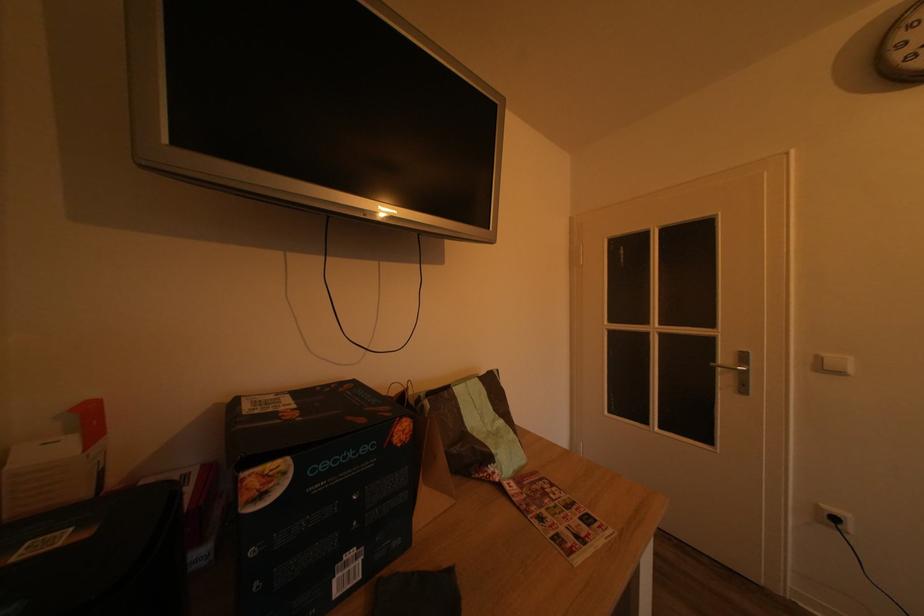
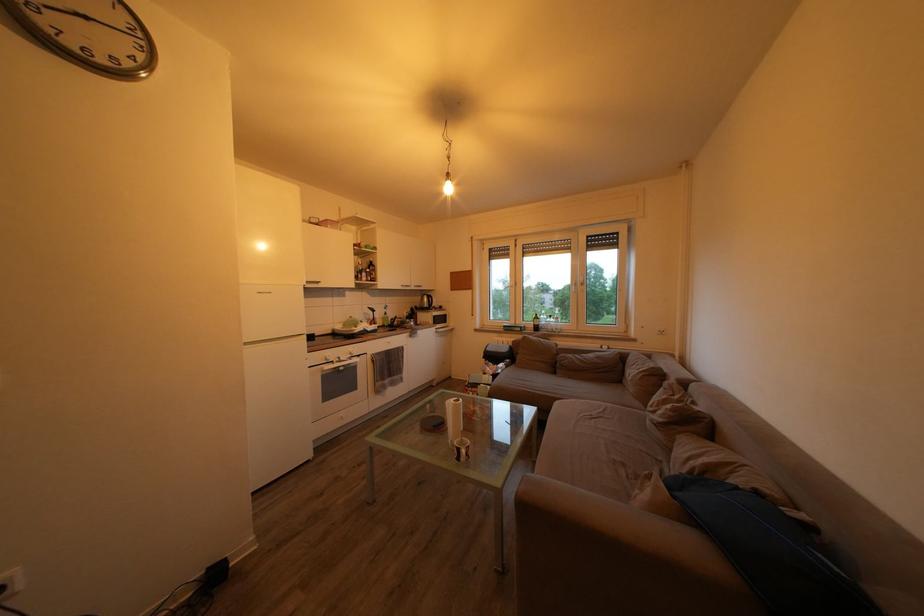
Question: The camera is either moving clockwise (left) or counter-clockwise (right) around the object. The first image is from the beginning of the video and the second image is from the end. Is the camera moving left or right when shooting the video?

Choices:
 (A) Left
 (B) Right

Answer: (A)